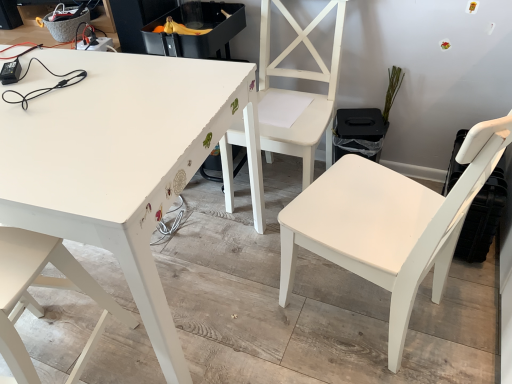
Find the location of `vacant area situated below white matte chair at center, arranged as the 3th chair when viewed from the left (from a real-world perspective)`. vacant area situated below white matte chair at center, arranged as the 3th chair when viewed from the left (from a real-world perspective) is located at coordinates (360, 302).